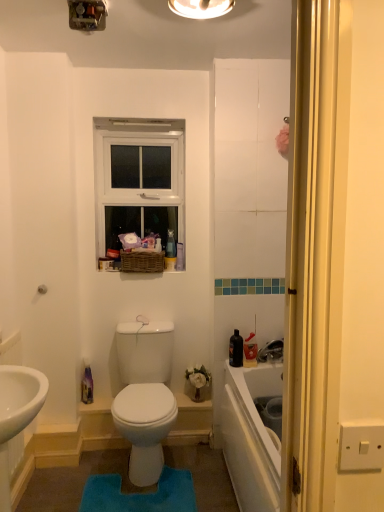
Question: From a real-world perspective, is metallic switchplate at upper center, which is the 2th light fixture in right-to-left order, positioned over matte white light fixture at upper center, arranged as the first light fixture when viewed from the right, based on gravity?

Choices:
 (A) yes
 (B) no

Answer: (B)

Question: Does metallic switchplate at upper center, which appears as the first light fixture when viewed from the left, appear on the right side of matte white light fixture at upper center, arranged as the second light fixture when viewed from the left?

Choices:
 (A) no
 (B) yes

Answer: (A)

Question: Can you confirm if metallic switchplate at upper center, which appears as the first light fixture when viewed from the left, is wider than matte white light fixture at upper center, arranged as the first light fixture when viewed from the right?

Choices:
 (A) no
 (B) yes

Answer: (A)

Question: Is metallic switchplate at upper center, which appears as the first light fixture when viewed from the left, with matte white light fixture at upper center, arranged as the second light fixture when viewed from the left?

Choices:
 (A) no
 (B) yes

Answer: (A)

Question: Is metallic switchplate at upper center, which is the 2th light fixture in right-to-left order, looking in the opposite direction of matte white light fixture at upper center, arranged as the first light fixture when viewed from the right?

Choices:
 (A) yes
 (B) no

Answer: (B)

Question: Considering the positions of point (193, 11) and point (76, 2), is point (193, 11) closer or farther from the camera than point (76, 2)?

Choices:
 (A) farther
 (B) closer

Answer: (A)

Question: In terms of size, does matte white light fixture at upper center, arranged as the second light fixture when viewed from the left, appear bigger or smaller than metallic switchplate at upper center, which is the 2th light fixture in right-to-left order?

Choices:
 (A) small
 (B) big

Answer: (B)

Question: From a real-world perspective, is matte white light fixture at upper center, arranged as the first light fixture when viewed from the right, above or below metallic switchplate at upper center, which appears as the first light fixture when viewed from the left?

Choices:
 (A) below
 (B) above

Answer: (B)

Question: Is matte white light fixture at upper center, arranged as the first light fixture when viewed from the right, wider or thinner than metallic switchplate at upper center, which is the 2th light fixture in right-to-left order?

Choices:
 (A) wide
 (B) thin

Answer: (A)

Question: From the image's perspective, is white plastic window at upper center above or below metallic switchplate at upper center, which is the 2th light fixture in right-to-left order?

Choices:
 (A) above
 (B) below

Answer: (B)

Question: Does point (119, 144) appear closer or farther from the camera than point (104, 27)?

Choices:
 (A) farther
 (B) closer

Answer: (A)

Question: From a real-world perspective, is white plastic window at upper center physically located above or below metallic switchplate at upper center, which appears as the first light fixture when viewed from the left?

Choices:
 (A) above
 (B) below

Answer: (B)

Question: Visually, is white plastic window at upper center positioned to the left or to the right of metallic switchplate at upper center, which appears as the first light fixture when viewed from the left?

Choices:
 (A) left
 (B) right

Answer: (B)

Question: Do you think blue plush bath mat at center is within metallic switchplate at upper center, which appears as the first light fixture when viewed from the left, or outside of it?

Choices:
 (A) inside
 (B) outside

Answer: (B)

Question: Is blue plush bath mat at center taller or shorter than metallic switchplate at upper center, which appears as the first light fixture when viewed from the left?

Choices:
 (A) short
 (B) tall

Answer: (A)